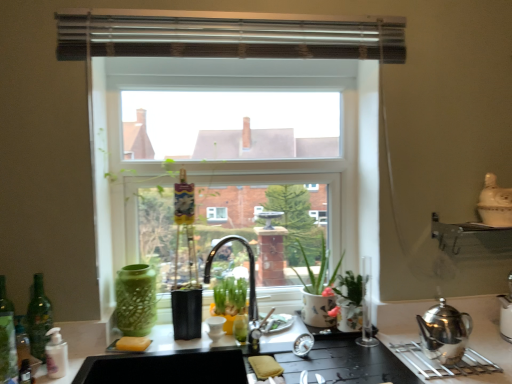
The height and width of the screenshot is (384, 512). Describe the element at coordinates (444, 365) in the screenshot. I see `polished stainless steel kettle at lower right` at that location.

Identify the location of polished stainless steel kettle at lower right. Image resolution: width=512 pixels, height=384 pixels. (444, 365).

Describe the element at coordinates (7, 337) in the screenshot. Image resolution: width=512 pixels, height=384 pixels. I see `green glass bottle at left, arranged as the 1th bottle when viewed from the left` at that location.

You are a GUI agent. You are given a task and a screenshot of the screen. Output one action in this format:
    pyautogui.click(x=<x>, y=<y>)
    Task: Click on the white ceramic pot at center
    This screenshot has height=384, width=512.
    Given the screenshot: What is the action you would take?
    pyautogui.click(x=318, y=290)

Describe the element at coordinates (232, 115) in the screenshot. I see `clear glass window at center` at that location.

Where is `polished stainless steel kettle at lower right`? Image resolution: width=512 pixels, height=384 pixels. polished stainless steel kettle at lower right is located at coordinates (444, 365).

From a real-world perspective, is clear glass window at center over white ceramic vase at upper right?

Indeed, from a real-world perspective, clear glass window at center stands above white ceramic vase at upper right.

Based on the photo, is clear glass window at center next to white ceramic vase at upper right?

clear glass window at center and white ceramic vase at upper right are clearly separated.

Is point (237, 51) positioned in front of point (482, 201)?

No.

Based on the photo, which of these two, clear glass window at center or white ceramic vase at upper right, is wider?

Wider between the two is white ceramic vase at upper right.

Can green textured vase at left be found inside polished stainless steel kettle at lower right?

Actually, green textured vase at left is outside polished stainless steel kettle at lower right.

In terms of width, does polished stainless steel kettle at lower right look wider or thinner when compared to green textured vase at left?

Clearly, polished stainless steel kettle at lower right has more width compared to green textured vase at left.

Is polished stainless steel kettle at lower right facing towards green textured vase at left?

No, polished stainless steel kettle at lower right does not turn towards green textured vase at left.

Does point (467, 364) come farther from viewer compared to point (131, 280)?

No, it is in front of (131, 280).

Can you confirm if green glass bottle at left, arranged as the 1th bottle when viewed from the left, is bigger than white ceramic pot at center?

Incorrect, green glass bottle at left, arranged as the 1th bottle when viewed from the left, is not larger than white ceramic pot at center.

From a real-world perspective, is green glass bottle at left, the 3th bottle positioned from the right, positioned above or below white ceramic pot at center?

In terms of real-world spatial position, green glass bottle at left, the 3th bottle positioned from the right, is below white ceramic pot at center.

Is green glass bottle at left, arranged as the 1th bottle when viewed from the left, oriented away from white ceramic pot at center?

No, white ceramic pot at center is not at the back of green glass bottle at left, arranged as the 1th bottle when viewed from the left.

Can you confirm if green glass bottle at left, the 3th bottle positioned from the right, is wider than white ceramic pot at center?

No.

Does point (37, 351) lie in front of point (3, 277)?

That is True.

Does green glass bottle at left, acting as the 2th bottle starting from the right, have a greater width compared to green glass bottle at left, the 3th bottle positioned from the right?

Yes.

Is green glass bottle at left, the 2th bottle in the left-to-right sequence, inside the boundaries of green glass bottle at left, the 3th bottle positioned from the right, or outside?

green glass bottle at left, the 2th bottle in the left-to-right sequence, is not enclosed by green glass bottle at left, the 3th bottle positioned from the right.

Is point (413, 348) closer or farther from the camera than point (250, 52)?

Point (413, 348).

In the scene shown: Would you consider polished stainless steel kettle at lower right to be distant from clear glass window at center?

No, polished stainless steel kettle at lower right is not far away from clear glass window at center.

Identify the location of window above the polished stainless steel kettle at lower right (from the image's perspective). (232, 115).

Is white ceramic vase at upper right not near white matte bottle at lower left, the 1th bottle from the right?

That's right, there is a large distance between white ceramic vase at upper right and white matte bottle at lower left, the 1th bottle from the right.

Which is closer, (507, 214) or (53, 373)?

The point (53, 373) is in front.

Would you say white matte bottle at lower left, the 1th bottle from the right, is part of white ceramic vase at upper right's contents?

No, white matte bottle at lower left, the 1th bottle from the right, is not inside white ceramic vase at upper right.

In the scene shown: Is white ceramic vase at upper right facing away from white matte bottle at lower left, the 3th bottle viewed from the left?

white ceramic vase at upper right is not turned away from white matte bottle at lower left, the 3th bottle viewed from the left.

Considering the relative sizes of clear glass window at center and green textured vase at left in the image provided, is clear glass window at center taller than green textured vase at left?

Yes.

From the picture: From a real-world perspective, is clear glass window at center under green textured vase at left?

Actually, clear glass window at center is physically above green textured vase at left in the real world.

Considering the sizes of clear glass window at center and green textured vase at left in the image, is clear glass window at center bigger or smaller than green textured vase at left?

Clearly, clear glass window at center is larger in size than green textured vase at left.

Image resolution: width=512 pixels, height=384 pixels. Find the location of `appliance that appears in front of the clear glass window at center`. appliance that appears in front of the clear glass window at center is located at coordinates (495, 203).

The width and height of the screenshot is (512, 384). I want to click on glass vase located above the polished stainless steel kettle at lower right (from a real-world perspective), so click(x=136, y=300).

Looking at the image, which one is located closer to clear glass window at center, white ceramic vase at upper right or green matte plant at center?

Based on the image, green matte plant at center appears to be nearer to clear glass window at center.

When comparing their distances from white matte bottle at lower left, the 3th bottle viewed from the left, does green textured vase at left or silver metallic teapot at right seem further?

silver metallic teapot at right lies further to white matte bottle at lower left, the 3th bottle viewed from the left, than the other object.

When comparing their distances from green glass bottle at left, acting as the 2th bottle starting from the right, does white matte bottle at lower left, the 3th bottle viewed from the left, or yellow matte sponge at lower center seem closer?

white matte bottle at lower left, the 3th bottle viewed from the left, lies closer to green glass bottle at left, acting as the 2th bottle starting from the right, than the other object.

From the image, which object appears to be nearer to white matte bottle at lower left, the 1th bottle from the right, clear glass window at center or metallic silver exhaust hood at upper center?

The object closer to white matte bottle at lower left, the 1th bottle from the right, is clear glass window at center.

Estimate the real-world distances between objects in this image. Which object is further from silver metallic teapot at right, clear glass window at center or white ceramic vase at upper right?

clear glass window at center.

From the image, which object appears to be nearer to green glass bottle at left, acting as the 2th bottle starting from the right, yellow matte sponge at lower center or polished stainless steel kettle at lower right?

yellow matte sponge at lower center is closer to green glass bottle at left, acting as the 2th bottle starting from the right.

From the image, which object appears to be farther from green textured vase at left, green glass bottle at left, the 2th bottle in the left-to-right sequence, or green glass bottle at left, arranged as the 1th bottle when viewed from the left?

green glass bottle at left, arranged as the 1th bottle when viewed from the left, is further to green textured vase at left.

Estimate the real-world distances between objects in this image. Which object is further from yellow matte sponge at lower center, white ceramic pot at center or metallic silver exhaust hood at upper center?

metallic silver exhaust hood at upper center is further to yellow matte sponge at lower center.

This screenshot has height=384, width=512. What are the coordinates of `plant located between yellow matte sponge at lower center and white ceramic pot at center in the left-right direction` in the screenshot? It's located at (230, 295).

In order to click on houseplant situated between clear glass window at center and silver metallic teapot at right from left to right in this screenshot , I will do `click(318, 290)`.

At what (x,y) coordinates should I click in order to perform the action: click on window situated between white matte bottle at lower left, the 3th bottle viewed from the left, and silver metallic teapot at right from left to right. Please return your answer as a coordinate pair (x, y). Image resolution: width=512 pixels, height=384 pixels. Looking at the image, I should click on click(232, 115).

You are a GUI agent. You are given a task and a screenshot of the screen. Output one action in this format:
    pyautogui.click(x=<x>, y=<y>)
    Task: Click on the exhaust hood between green matte plant at center and white ceramic vase at upper right in the horizontal direction
    The width and height of the screenshot is (512, 384).
    Given the screenshot: What is the action you would take?
    pyautogui.click(x=226, y=35)